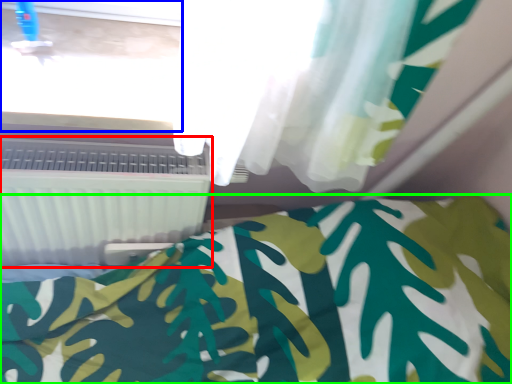
Question: Which object is positioned closest to air conditioning (highlighted by a red box)? Select from window frame (highlighted by a blue box) and bed (highlighted by a green box).

Choices:
 (A) window frame
 (B) bed

Answer: (A)